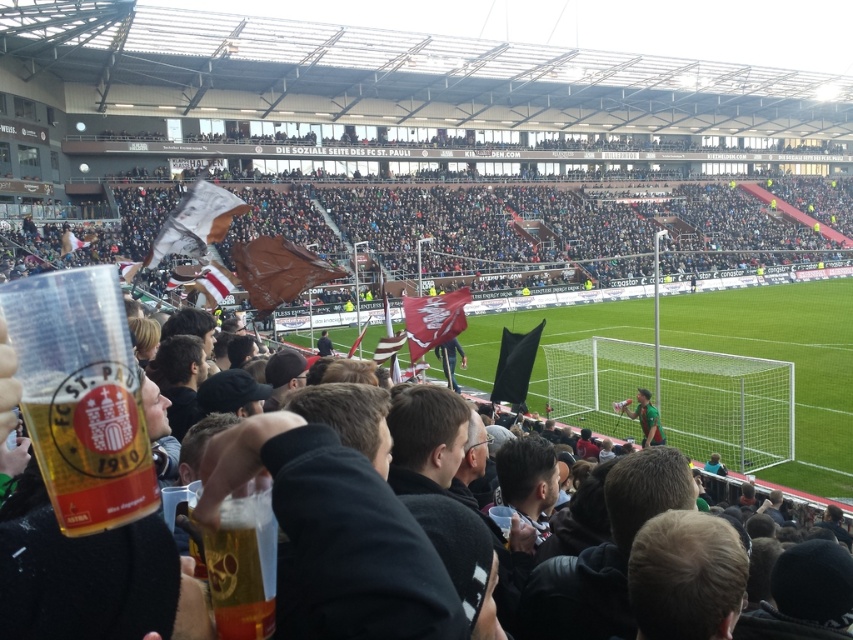
You are a photographer at the stadium and want to capture a photo of the translucent plastic cup at center. What are the coordinates where you should focus your camera?

The coordinates for the translucent plastic cup at center are at point (x=242, y=566).

You are a photographer at the stadium and want to capture a photo where both the green grass football field at center and the translucent plastic cup at center are visible. Which object should you zoom in on to ensure both are in frame without cropping?

The green grass football field at center is wider than the translucent plastic cup at center, so you should zoom in on the green grass football field at center to ensure both are visible without cropping.